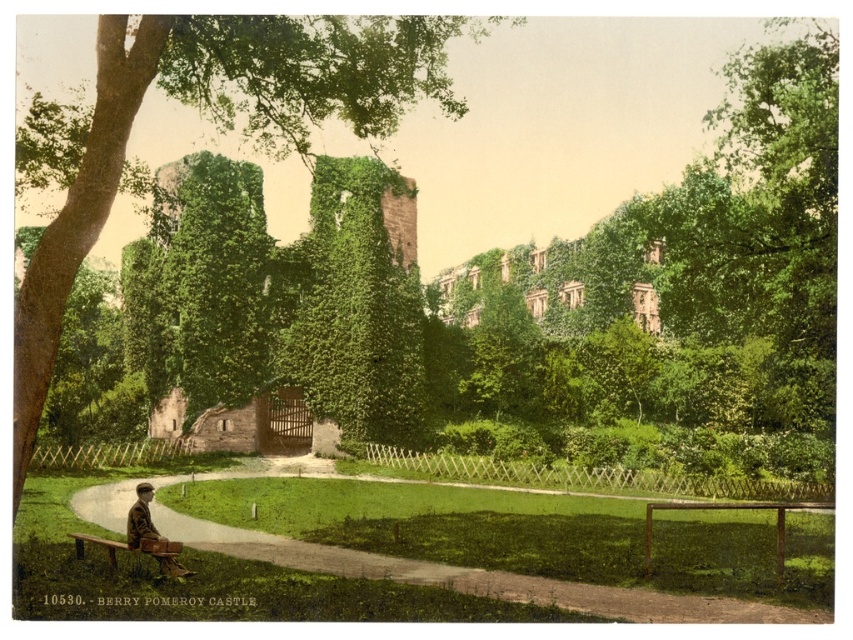
Is green ivy-covered wall at center smaller than wooden park bench at lower left?

No.

Does green ivy-covered wall at center appear over wooden park bench at lower left?

Yes.

The image size is (853, 640). What do you see at coordinates (357, 305) in the screenshot?
I see `green ivy-covered wall at center` at bounding box center [357, 305].

What are the coordinates of `green ivy-covered wall at center` in the screenshot? It's located at 357,305.

Does point (161, 540) come in front of point (189, 576)?

Yes, point (161, 540) is closer to viewer.

Is point (132, 544) positioned before point (161, 566)?

No.

Identify the location of wooden park bench at lower left. The width and height of the screenshot is (853, 640). (138, 550).

Does green leafy tree at center have a larger size compared to green ivy-covered wall at center?

Indeed, green leafy tree at center has a larger size compared to green ivy-covered wall at center.

Is point (56, 125) positioned behind point (355, 417)?

No, it is not.

Is point (122, 45) positioned after point (363, 380)?

No, it is not.

This screenshot has width=853, height=640. What are the coordinates of `green leafy tree at center` in the screenshot? It's located at (212, 122).